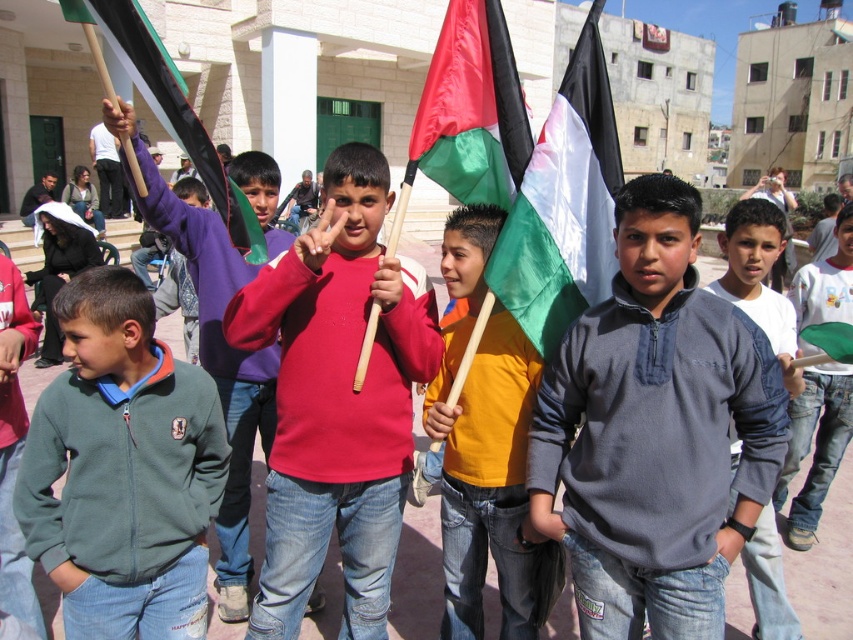
Question: Which object is farther from the camera taking this photo?

Choices:
 (A) matte red sweater at center
 (B) silky fabric flag at center
 (C) silky satin flag at center
 (D) gray fleece jacket at center

Answer: (D)

Question: Which of these objects is positioned farthest from the green fleece jacket at left?

Choices:
 (A) orange cotton shirt at center
 (B) gray fleece jacket at center

Answer: (B)

Question: Can you confirm if green fleece jacket at left is bigger than matte purple hoodie at center?

Choices:
 (A) no
 (B) yes

Answer: (A)

Question: Is matte red sweater at center positioned behind green matte flag at upper left?

Choices:
 (A) no
 (B) yes

Answer: (B)

Question: Which of the following is the farthest from the observer?

Choices:
 (A) (592, 301)
 (B) (805, 323)

Answer: (B)

Question: Is gray fleece jacket at center further to camera compared to green denim jeans at center?

Choices:
 (A) no
 (B) yes

Answer: (A)